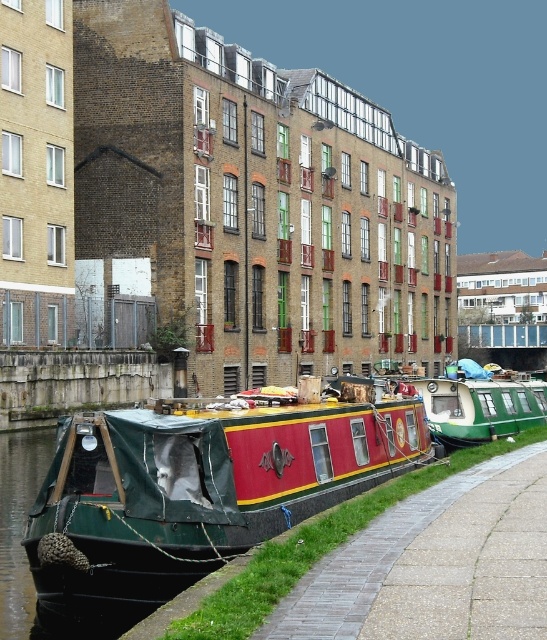
Question: Which point appears closest to the camera in this image?

Choices:
 (A) (200, 552)
 (B) (354, 600)

Answer: (B)

Question: Is green painted wooden barge at lower left below paved concrete path at lower right?

Choices:
 (A) no
 (B) yes

Answer: (A)

Question: Which of the following is the farthest from the observer?

Choices:
 (A) (398, 464)
 (B) (400, 593)

Answer: (A)

Question: Does green painted wooden barge at lower left appear over paved concrete path at lower right?

Choices:
 (A) yes
 (B) no

Answer: (A)

Question: Does green painted wooden barge at lower left appear on the right side of paved concrete path at lower right?

Choices:
 (A) no
 (B) yes

Answer: (A)